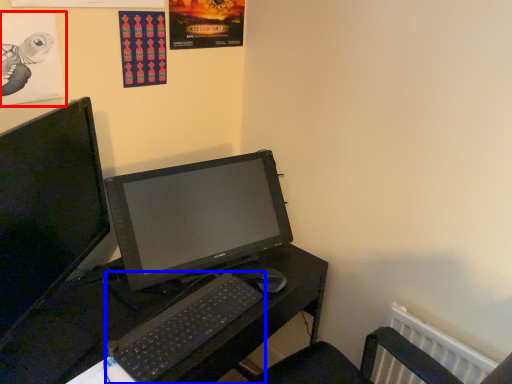
Question: Among these objects, which one is nearest to the camera, poster page (highlighted by a red box) or computer keyboard (highlighted by a blue box)?

Choices:
 (A) poster page
 (B) computer keyboard

Answer: (A)